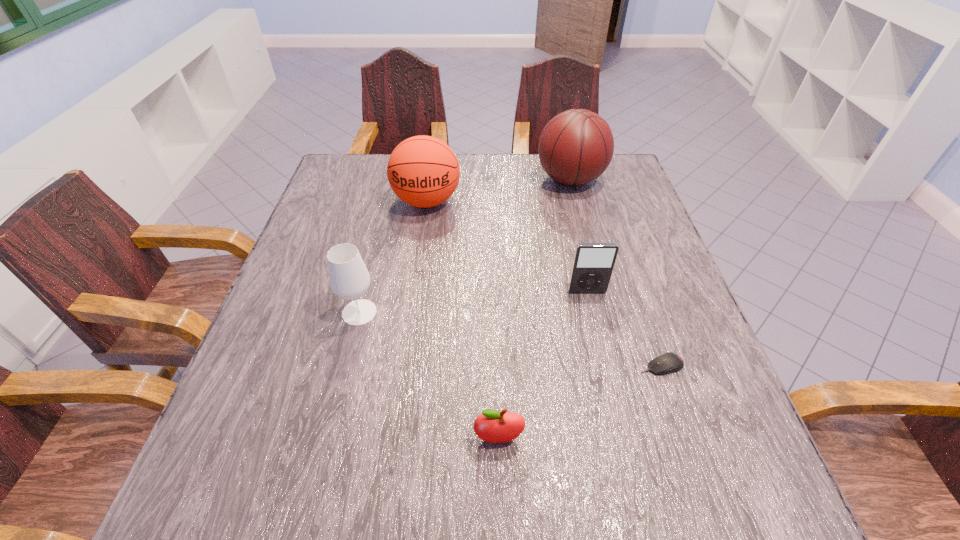
What are the coordinates of `empty space between the fourth nearest object and the right basketball` in the screenshot? It's located at (579, 236).

Image resolution: width=960 pixels, height=540 pixels. In order to click on empty location between the second nearest object and the right basketball in this screenshot , I will do `click(615, 273)`.

Locate an element on the screen. free space between the right basketball and the left basketball is located at coordinates (498, 191).

Locate an element on the screen. Image resolution: width=960 pixels, height=540 pixels. free space between the right basketball and the glass is located at coordinates (465, 246).

Locate which object is the fourth closest to the fourth farthest object. Please provide its 2D coordinates. Your answer should be formatted as a tuple, i.e. [(x, y)], where the tuple contains the x and y coordinates of a point satisfying the conditions above.

[(666, 363)]

Point out which object is positioned as the fifth nearest to the computer mouse. Please provide its 2D coordinates. Your answer should be formatted as a tuple, i.e. [(x, y)], where the tuple contains the x and y coordinates of a point satisfying the conditions above.

[(423, 171)]

Identify the location of vacant space that satisfies the following two spatial constraints: 1. on the side with logo of the left basketball; 2. on the right side of the fourth object from right to left. (393, 438).

Identify the location of free location that satisfies the following two spatial constraints: 1. on the front side of the shortest object; 2. on the left side of the fourth farthest object. (346, 366).

Locate an element on the screen. The height and width of the screenshot is (540, 960). free spot that satisfies the following two spatial constraints: 1. on the side with logo of the fourth object from right to left; 2. on the left side of the left basketball is located at coordinates (393, 438).

Identify the location of blank area in the image that satisfies the following two spatial constraints: 1. on the back side of the nearest object; 2. on the right side of the computer mouse. The image size is (960, 540). (496, 366).